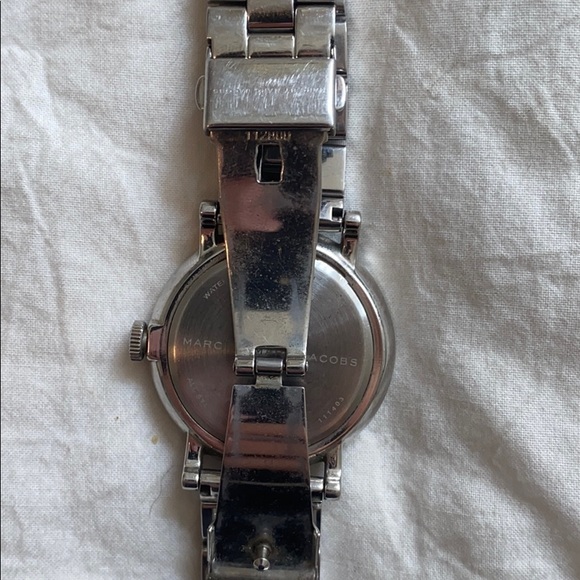
You are a GUI agent. You are given a task and a screenshot of the screen. Output one action in this format:
    pyautogui.click(x=<x>, y=<y>)
    Task: Click on the white cloth background
    Image resolution: width=580 pixels, height=580 pixels.
    Given the screenshot: What is the action you would take?
    pyautogui.click(x=458, y=220)